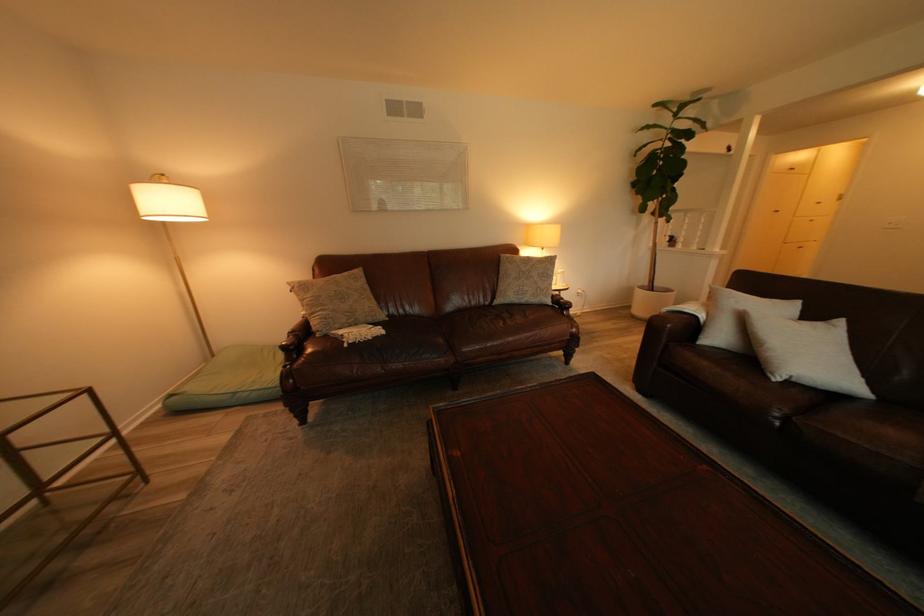
Describe the element at coordinates (775, 209) in the screenshot. I see `the cabinet door handle` at that location.